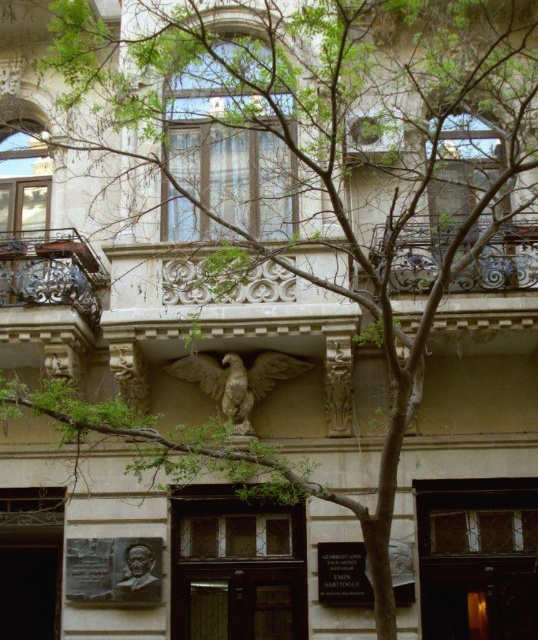
You are an architect inspecting the building facade. You notice the dark brown ornate metalwork at left and the bronze relief at lower center. Which object is positioned to the left side of the other?

The dark brown ornate metalwork at left is to the left of bronze relief at lower center.

You are an architect designing a new building and want to incorporate elements from this image. If you need to choose between the dark brown wrought iron balcony at left and the dark brown ornate metalwork at left for a larger decorative feature, which one would you select based on their sizes?

The dark brown wrought iron balcony at left has a larger width than the dark brown ornate metalwork at left, so you should select the dark brown wrought iron balcony at left for the larger decorative feature.

You are standing in front of the building and notice the dark brown wrought iron balcony at left. Can you determine its exact location on the facade based on the coordinates provided?

The dark brown wrought iron balcony at left is located at point coordinates of (51,273).